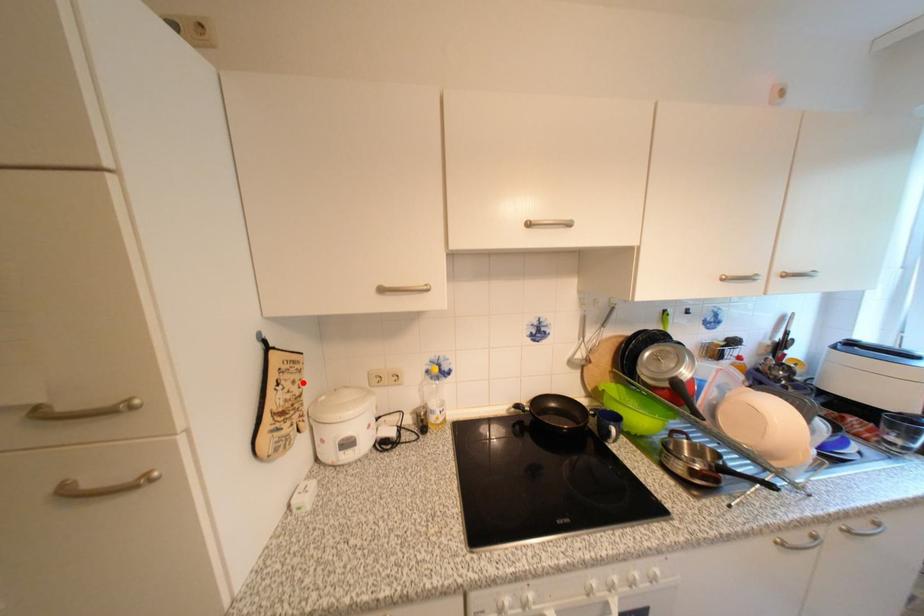
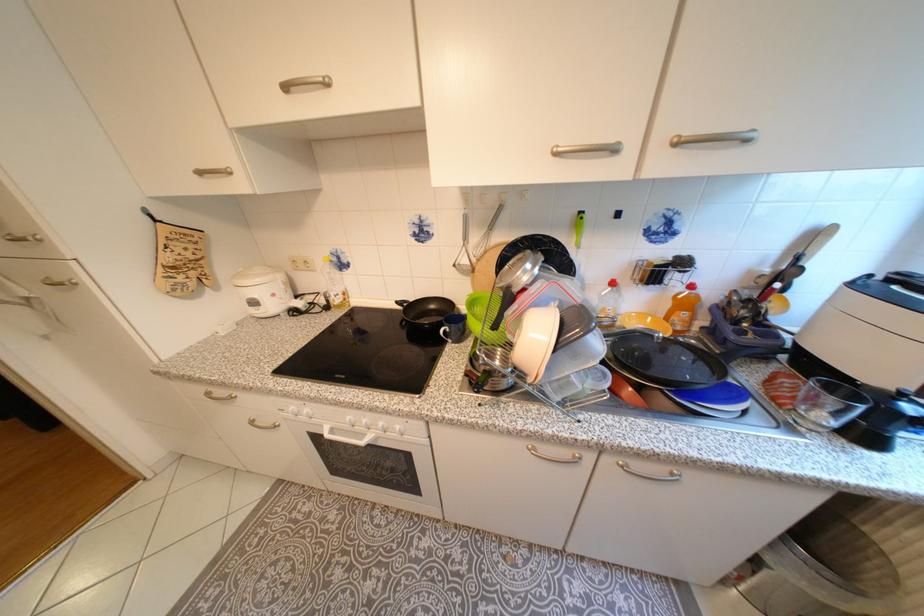
In the second image, find the point that corresponds to the highlighted location in the first image.

(196, 249)